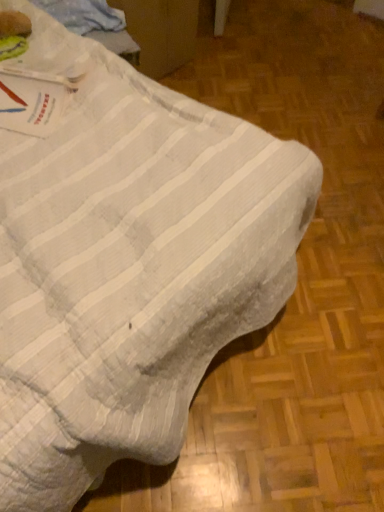
Where is `vacant area that lies to the right of white fabric-covered box at upper left`? Image resolution: width=384 pixels, height=512 pixels. vacant area that lies to the right of white fabric-covered box at upper left is located at coordinates (227, 66).